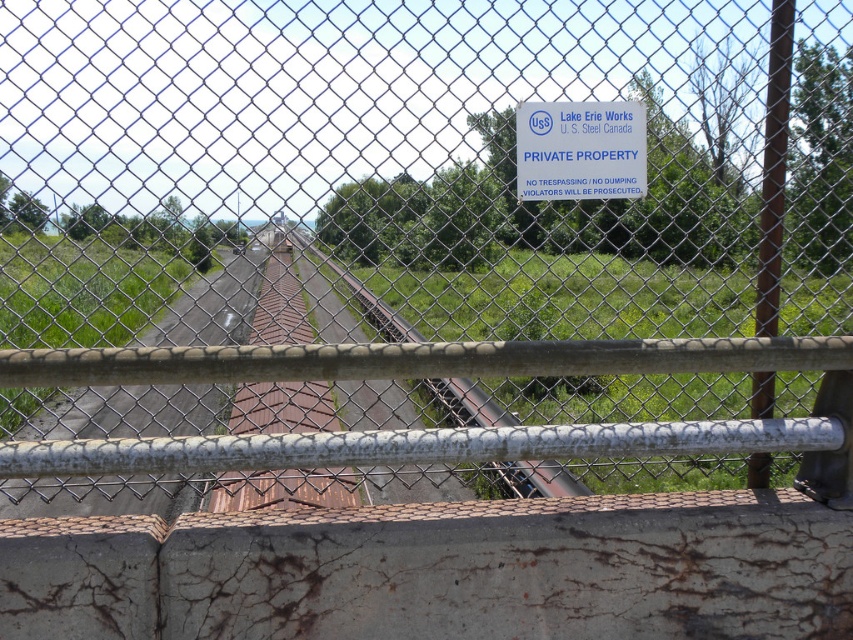
Question: Does blue plastic sign at upper center appear on the right side of brown corrugated metal train track at center?

Choices:
 (A) no
 (B) yes

Answer: (B)

Question: Can you confirm if blue plastic sign at upper center is positioned to the right of brown corrugated metal train track at center?

Choices:
 (A) no
 (B) yes

Answer: (B)

Question: Which point is farther to the camera?

Choices:
 (A) blue plastic sign at upper center
 (B) brown corrugated metal train track at center

Answer: (B)

Question: Which object is closer to the camera taking this photo?

Choices:
 (A) blue plastic sign at upper center
 (B) brown corrugated metal train track at center

Answer: (A)

Question: Can you confirm if blue plastic sign at upper center is bigger than brown corrugated metal train track at center?

Choices:
 (A) no
 (B) yes

Answer: (A)